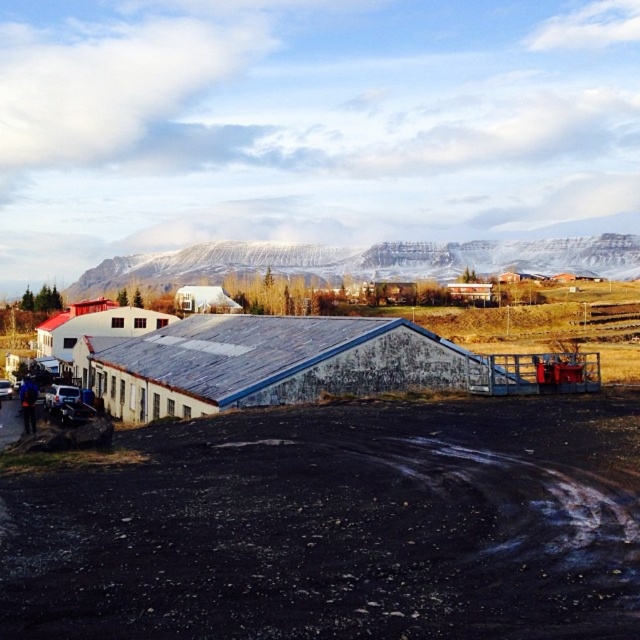
Question: Which point is farther to the camera?

Choices:
 (A) (595, 264)
 (B) (106, 554)

Answer: (A)

Question: Is black gravel dirt track at lower left to the left of snowy rock formation at upper center from the viewer's perspective?

Choices:
 (A) no
 (B) yes

Answer: (B)

Question: Does black gravel dirt track at lower left have a smaller size compared to snowy rock formation at upper center?

Choices:
 (A) no
 (B) yes

Answer: (B)

Question: Which object is closer to the camera taking this photo?

Choices:
 (A) snowy rock formation at upper center
 (B) black gravel dirt track at lower left

Answer: (B)

Question: Can you confirm if black gravel dirt track at lower left is positioned above snowy rock formation at upper center?

Choices:
 (A) no
 (B) yes

Answer: (A)